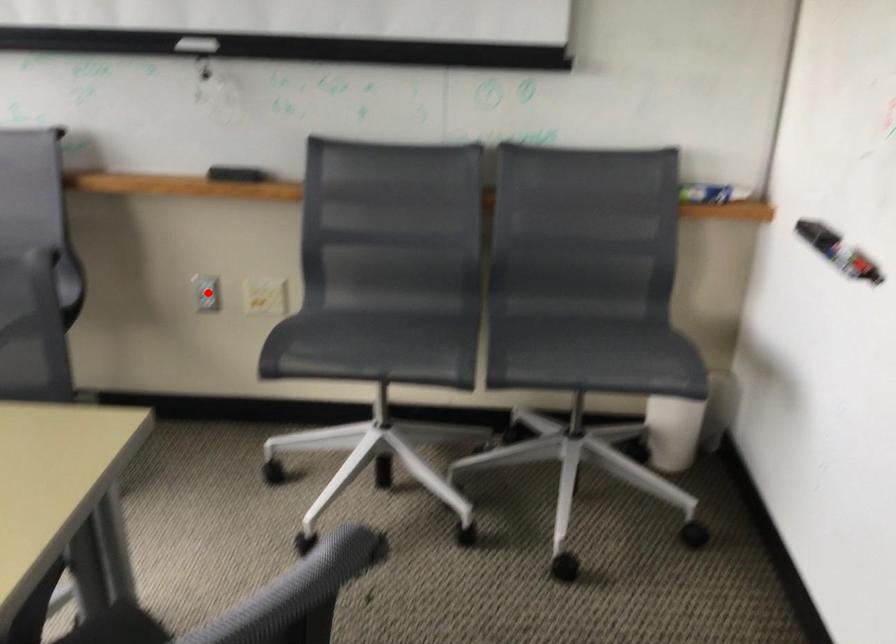
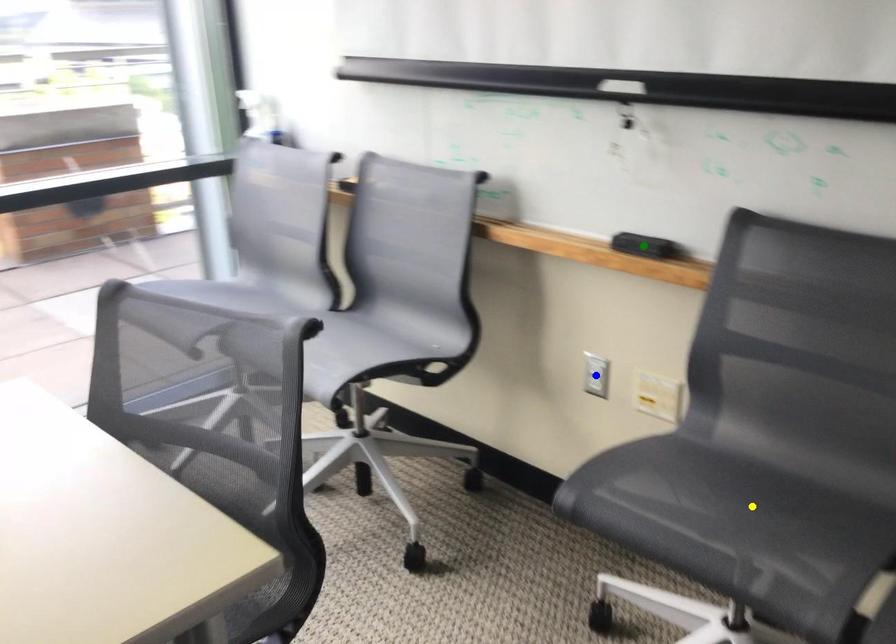
Question: I am providing you with two images of the same scene from different viewpoints. A red point is marked on the first image. You are given multiple points on the second image. Which spot in image 2 lines up with the point in image 1?

Choices:
 (A) green point
 (B) blue point
 (C) yellow point

Answer: (B)